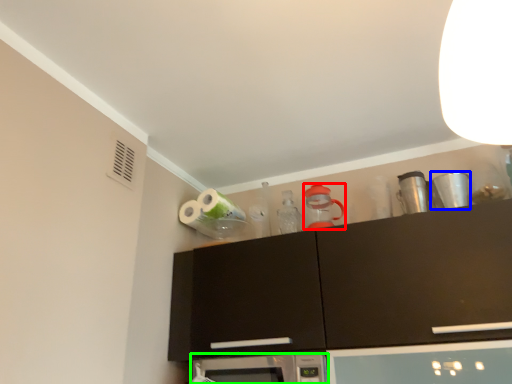
Question: Which object is the closest to the appliance (highlighted by a red box)? Choose among these: appliance (highlighted by a blue box) or microwave oven (highlighted by a green box).

Choices:
 (A) appliance
 (B) microwave oven

Answer: (A)